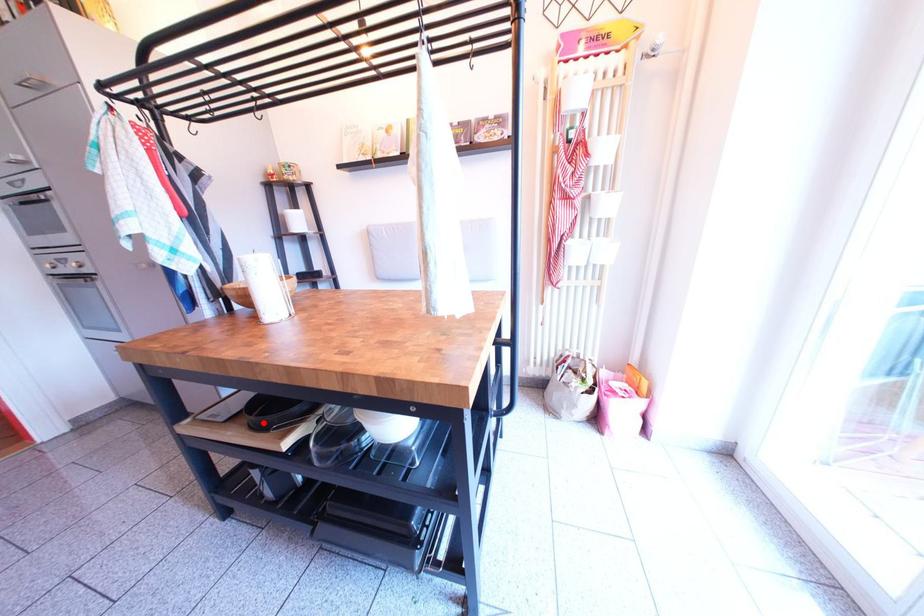
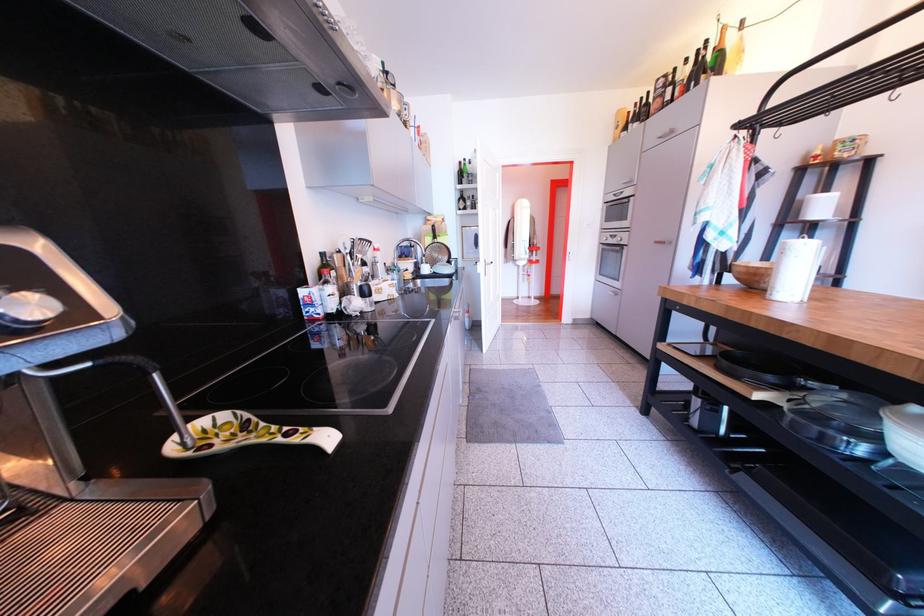
Where in the second image is the point corresponding to the highlighted location from the first image?

(736, 369)